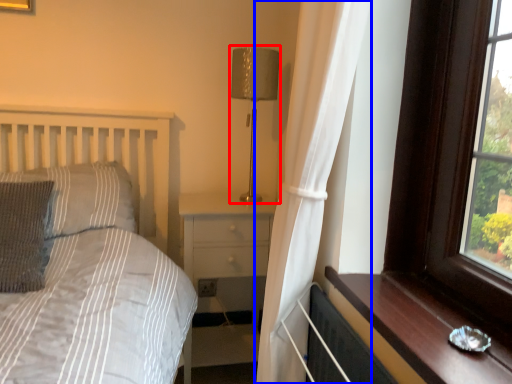
Question: Which point is further to the camera, table lamp (highlighted by a red box) or curtain (highlighted by a blue box)?

Choices:
 (A) table lamp
 (B) curtain

Answer: (A)